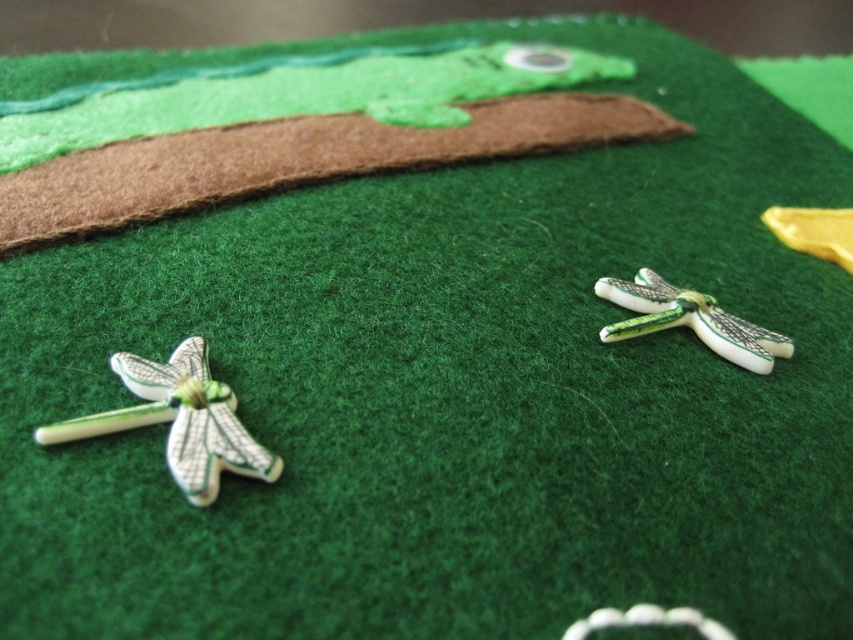
Question: Is the position of white glossy dragonfly at lower left less distant than that of green glossy dragonfly at right?

Choices:
 (A) no
 (B) yes

Answer: (B)

Question: Which point appears farthest from the camera in this image?

Choices:
 (A) (792, 348)
 (B) (59, 429)

Answer: (A)

Question: Can you confirm if white glossy dragonfly at lower left is thinner than green glossy dragonfly at right?

Choices:
 (A) yes
 (B) no

Answer: (B)

Question: Is white glossy dragonfly at lower left further to camera compared to green glossy dragonfly at right?

Choices:
 (A) no
 (B) yes

Answer: (A)

Question: Which of the following is the farthest from the observer?

Choices:
 (A) (120, 352)
 (B) (664, 310)

Answer: (B)